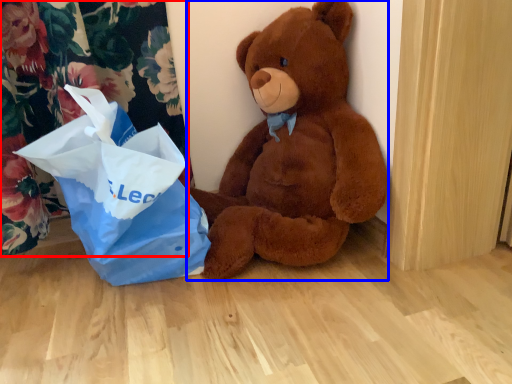
Question: Which object is further to the camera taking this photo, curtain (highlighted by a red box) or teddy bear (highlighted by a blue box)?

Choices:
 (A) curtain
 (B) teddy bear

Answer: (A)